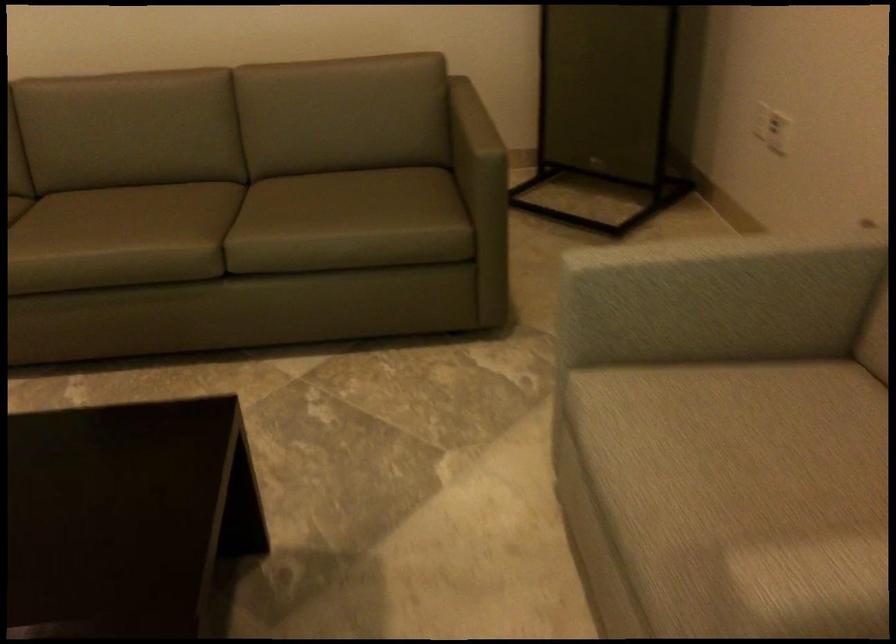
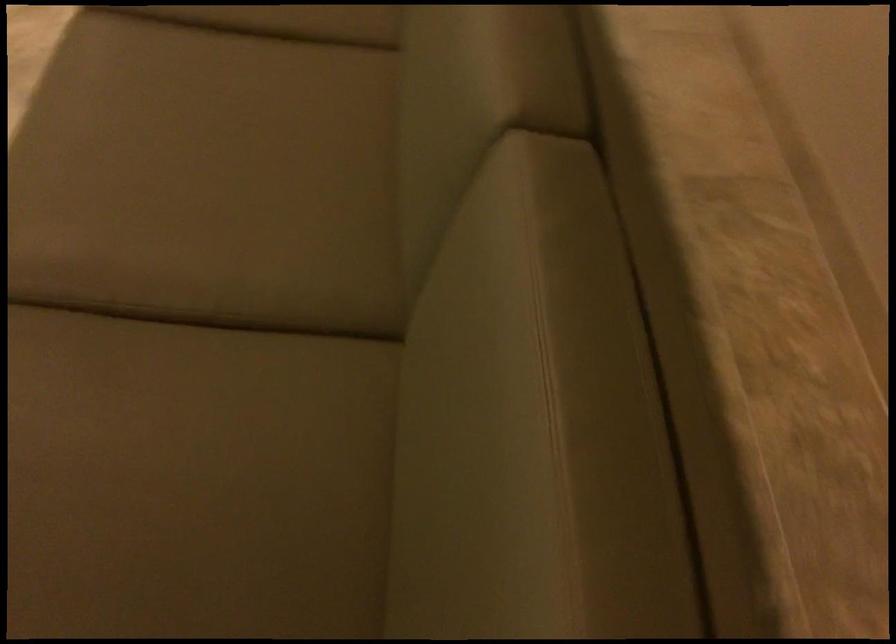
In the second image, find the point that corresponds to [233,209] in the first image.

(211, 339)